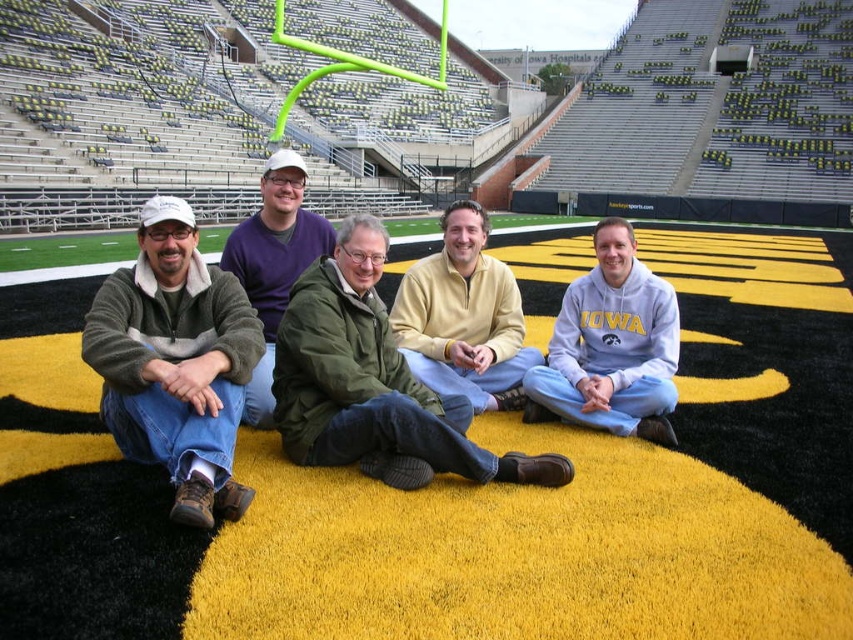
Question: Which point is closer to the camera taking this photo?

Choices:
 (A) (306, 225)
 (B) (474, 216)
 (C) (370, 236)

Answer: (C)

Question: Can you confirm if light blue sweatshirt at center is positioned above purple fleece sweater at center?

Choices:
 (A) yes
 (B) no

Answer: (B)

Question: Does gray-green sweater at left lie behind green matte jacket at center?

Choices:
 (A) no
 (B) yes

Answer: (A)

Question: Is green matte jacket at center wider than light blue sweatshirt at center?

Choices:
 (A) no
 (B) yes

Answer: (B)

Question: Which of the following is the farthest from the observer?

Choices:
 (A) gray-green sweater at left
 (B) purple fleece sweater at center

Answer: (B)

Question: Estimate the real-world distances between objects in this image. Which object is farther from the light blue sweatshirt at center?

Choices:
 (A) gray-green sweater at left
 (B) purple fleece sweater at center
 (C) green matte jacket at center

Answer: (A)